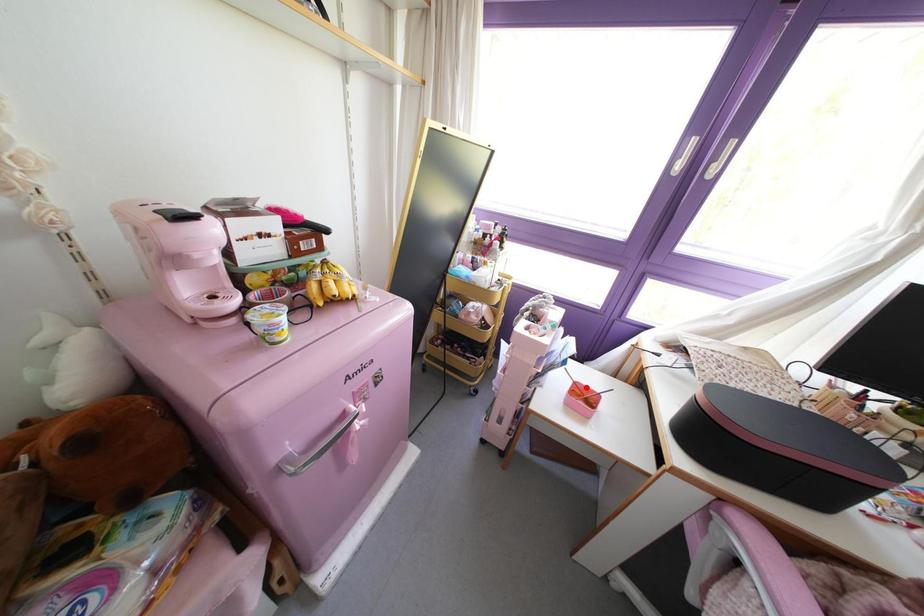
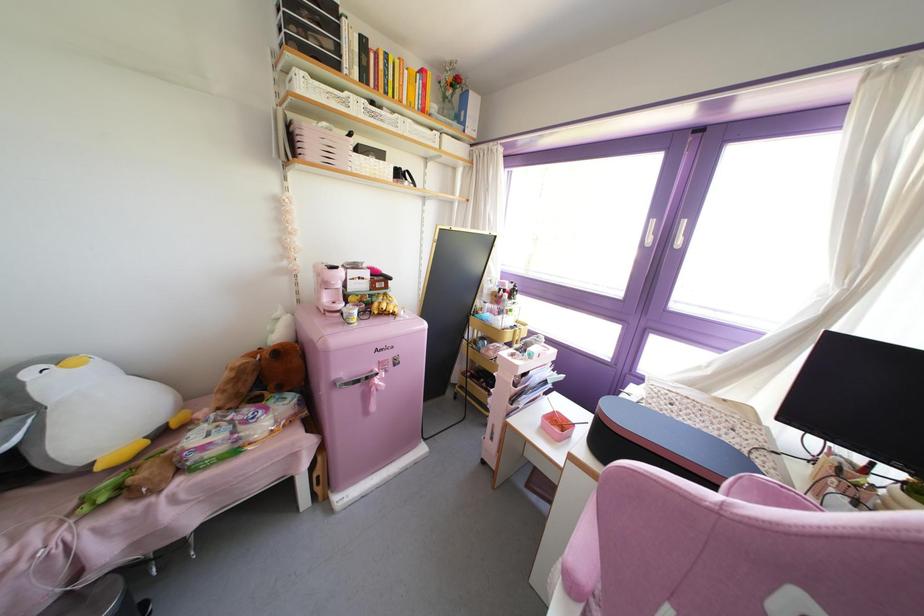
Question: I am providing you with two images of the same scene from different viewpoints. A red point is marked on the first image. Is the red point's position out of view in image 2?

Choices:
 (A) Yes
 (B) No

Answer: (B)